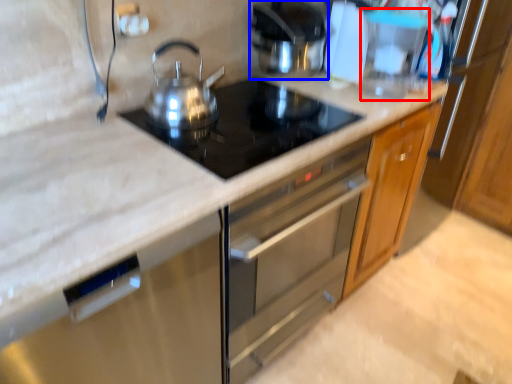
Question: Which object is further to the camera taking this photo, appliance (highlighted by a red box) or kitchen appliance (highlighted by a blue box)?

Choices:
 (A) appliance
 (B) kitchen appliance

Answer: (B)